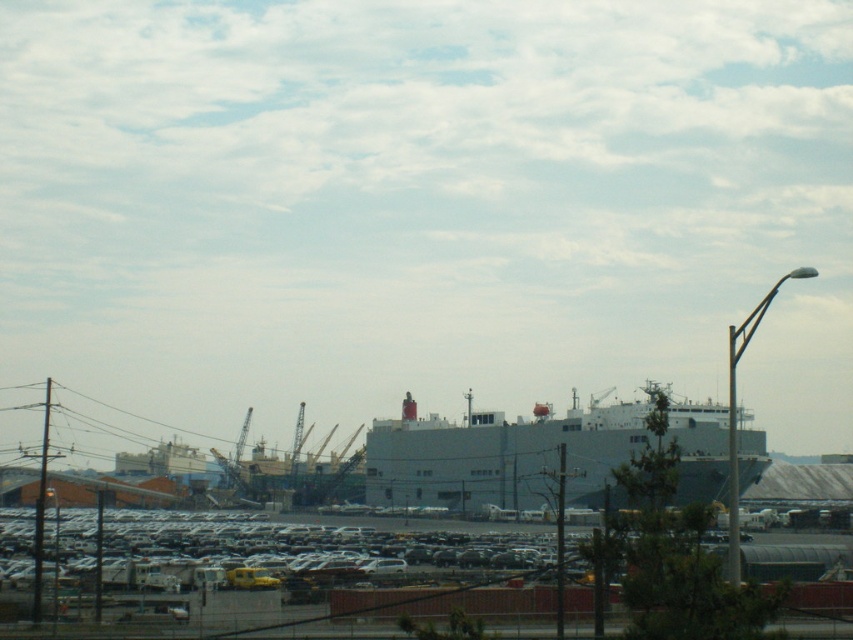
You are standing at the point marked as point (271, 538) in the image. You need to walk to the nearest crane. How far will you have to walk in meters?

The nearest crane is 137.35 meters away from point (271, 538), so you will have to walk 137.35 meters.

You are standing at the edge of the white matte parking lot at lower center and want to walk to the gray matte ship at center. Which direction should you move to get closer to the ship?

Since the white matte parking lot at lower center is closer to the viewer than the gray matte ship at center, you should move forward away from the parking lot towards the center of the image to reach the ship.

You are a delivery driver needing to park your truck in the white matte parking lot at lower center. The parking space is designed to accommodate vehicles up to the width of the gray matte ship at center. Can your truck fit in the parking space?

The white matte parking lot at lower center might be wider than the gray matte ship at center, so the parking space could potentially accommodate your truck if its width matches or is less than the ship. However, without exact measurements, it is uncertain.